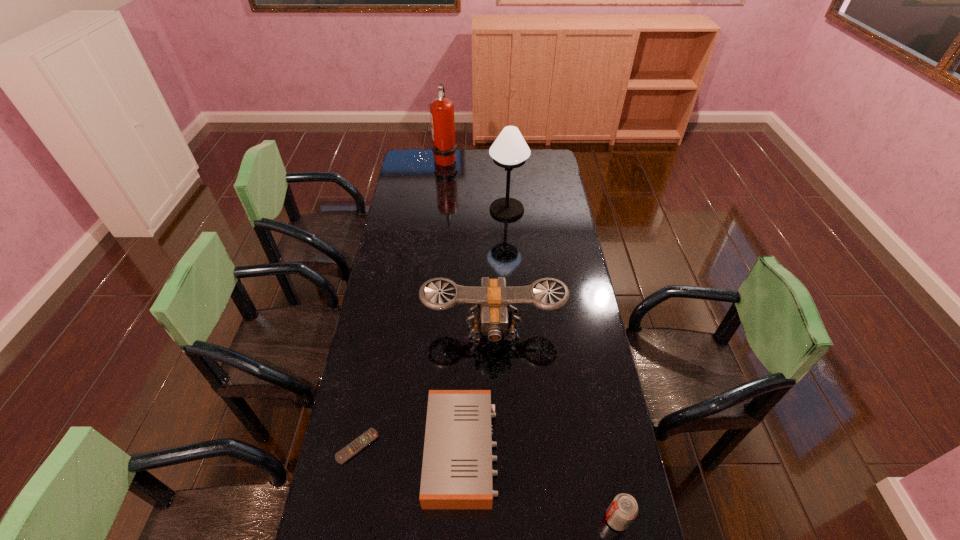
Where is `the farthest object`? The height and width of the screenshot is (540, 960). the farthest object is located at coordinates (444, 149).

Find the location of a particular element. Image resolution: width=960 pixels, height=540 pixels. table lamp is located at coordinates (509, 150).

Locate an element on the screen. This screenshot has height=540, width=960. drone is located at coordinates (493, 298).

Where is `the third farthest object`? Image resolution: width=960 pixels, height=540 pixels. the third farthest object is located at coordinates (493, 298).

The image size is (960, 540). Find the location of `the fourth tallest object`. the fourth tallest object is located at coordinates (622, 511).

The width and height of the screenshot is (960, 540). I want to click on the rightmost object, so click(x=622, y=511).

Where is `radio receiver`? Image resolution: width=960 pixels, height=540 pixels. radio receiver is located at coordinates (457, 472).

Identify the location of remote control. The image size is (960, 540). (346, 453).

In order to click on the leftmost object in this screenshot , I will do `click(346, 453)`.

The height and width of the screenshot is (540, 960). I want to click on free space located 0.200m at the nozzle of the fire extinguisher, so click(x=493, y=159).